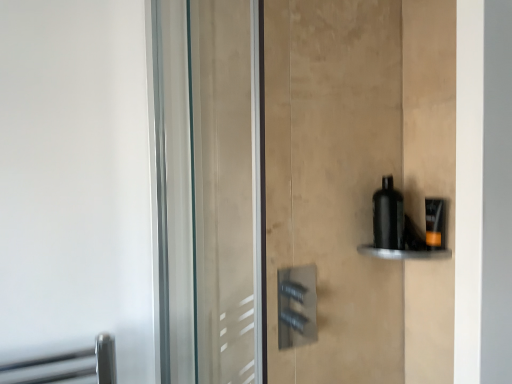
Question: Considering the relative sizes of black glossy bottle at right and black matte bottle at right in the image provided, is black glossy bottle at right smaller than black matte bottle at right?

Choices:
 (A) yes
 (B) no

Answer: (A)

Question: Can you confirm if black glossy bottle at right is shorter than black matte bottle at right?

Choices:
 (A) no
 (B) yes

Answer: (B)

Question: From the image's perspective, is black glossy bottle at right below black matte bottle at right?

Choices:
 (A) no
 (B) yes

Answer: (B)

Question: Is black glossy bottle at right positioned with its back to black matte bottle at right?

Choices:
 (A) no
 (B) yes

Answer: (A)

Question: From a real-world perspective, is black glossy bottle at right over black matte bottle at right?

Choices:
 (A) yes
 (B) no

Answer: (B)

Question: From a real-world perspective, is black matte bottle at right positioned above or below matte black bottle at right?

Choices:
 (A) below
 (B) above

Answer: (B)

Question: Is point (377, 221) positioned closer to the camera than point (442, 213)?

Choices:
 (A) farther
 (B) closer

Answer: (A)

Question: Is black matte bottle at right in front of or behind matte black bottle at right in the image?

Choices:
 (A) behind
 (B) front

Answer: (A)

Question: Is black matte bottle at right situated inside matte black bottle at right or outside?

Choices:
 (A) outside
 (B) inside

Answer: (A)

Question: Is point (437, 203) closer or farther from the camera than point (443, 258)?

Choices:
 (A) farther
 (B) closer

Answer: (A)

Question: Is matte black bottle at right in front of or behind black glossy bottle at right in the image?

Choices:
 (A) front
 (B) behind

Answer: (B)

Question: Is matte black bottle at right inside the boundaries of black glossy bottle at right, or outside?

Choices:
 (A) outside
 (B) inside

Answer: (A)

Question: Considering the relative positions of matte black bottle at right and black glossy bottle at right in the image provided, is matte black bottle at right to the left or to the right of black glossy bottle at right?

Choices:
 (A) left
 (B) right

Answer: (B)

Question: Is point (434, 208) positioned closer to the camera than point (389, 215)?

Choices:
 (A) farther
 (B) closer

Answer: (B)

Question: Considering the positions of matte black bottle at right and black matte bottle at right in the image, is matte black bottle at right taller or shorter than black matte bottle at right?

Choices:
 (A) short
 (B) tall

Answer: (A)